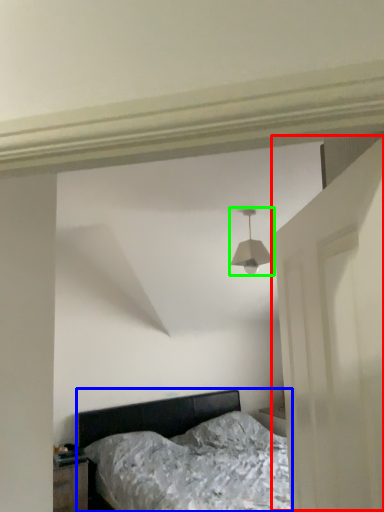
Question: Based on their relative distances, which object is farther from door (highlighted by a red box)? Choose from bed (highlighted by a blue box) and lamp (highlighted by a green box).

Choices:
 (A) bed
 (B) lamp

Answer: (A)